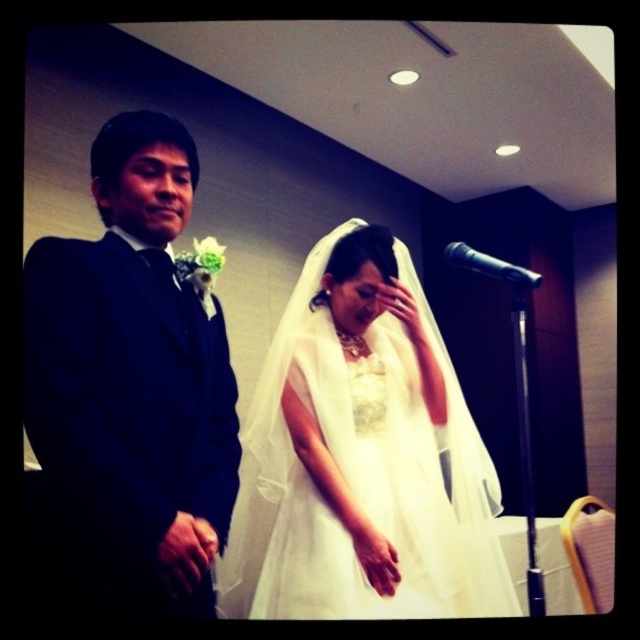
Does point (404, 392) come farther from viewer compared to point (163, 344)?

That is True.

Measure the distance between point (321, 410) and camera.

Point (321, 410) and camera are 1.82 meters apart.

The width and height of the screenshot is (640, 640). I want to click on white satin dress at center, so click(253, 419).

Is point (84, 433) positioned behind point (458, 252)?

No, (84, 433) is closer to viewer.

Is matte black suit at left to the right of black metallic microphone at right from the viewer's perspective?

Incorrect, matte black suit at left is not on the right side of black metallic microphone at right.

Does point (148, 541) come behind point (497, 262)?

No.

Where is `matte black suit at left`? matte black suit at left is located at coordinates 132,380.

Between white sheer dress at center and matte black suit at left, which one is positioned lower?

white sheer dress at center is below.

Can you confirm if white sheer dress at center is smaller than matte black suit at left?

Incorrect, white sheer dress at center is not smaller in size than matte black suit at left.

Where is `white sheer dress at center`? The image size is (640, 640). white sheer dress at center is located at coordinates (362, 456).

Locate an element on the screen. white sheer dress at center is located at coordinates (362, 456).